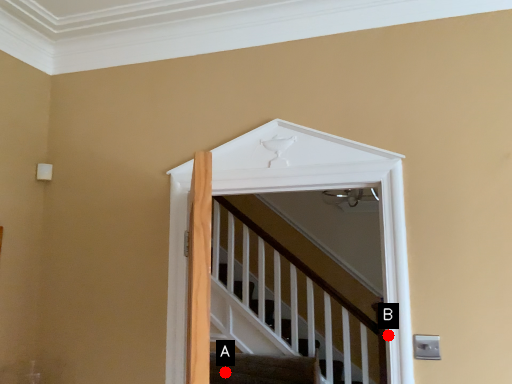
Question: Two points are circled on the image, labeled by A and B beside each circle. Which of the following is the farthest from the observer?

Choices:
 (A) A is further
 (B) B is further

Answer: (A)